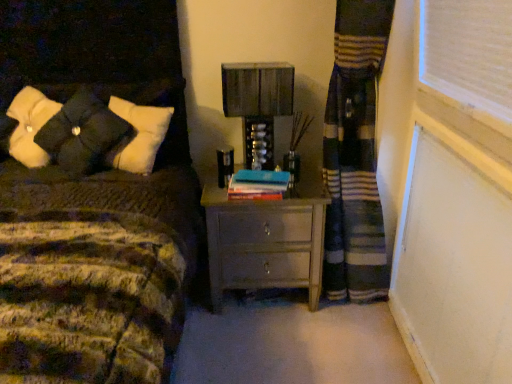
Question: Should I look upward or downward to see matte gray nightstand at center?

Choices:
 (A) down
 (B) up

Answer: (A)

Question: Are matte gray nightstand at center and metallic silver table lamp at center far apart?

Choices:
 (A) no
 (B) yes

Answer: (A)

Question: Is matte gray nightstand at center not inside metallic silver table lamp at center?

Choices:
 (A) yes
 (B) no

Answer: (A)

Question: Can you confirm if matte gray nightstand at center is wider than metallic silver table lamp at center?

Choices:
 (A) yes
 (B) no

Answer: (A)

Question: Is matte gray nightstand at center directly adjacent to metallic silver table lamp at center?

Choices:
 (A) no
 (B) yes

Answer: (A)

Question: Does matte gray nightstand at center have a lesser height compared to metallic silver table lamp at center?

Choices:
 (A) yes
 (B) no

Answer: (B)

Question: Is metallic silver table lamp at center completely or partially inside matte gray nightstand at center?

Choices:
 (A) yes
 (B) no

Answer: (B)

Question: Considering the relative sizes of metallic silver table lamp at center and matte gray nightstand at center in the image provided, is metallic silver table lamp at center taller than matte gray nightstand at center?

Choices:
 (A) yes
 (B) no

Answer: (B)

Question: Could you tell me if metallic silver table lamp at center is facing matte gray nightstand at center?

Choices:
 (A) no
 (B) yes

Answer: (A)

Question: Can you confirm if metallic silver table lamp at center is bigger than matte gray nightstand at center?

Choices:
 (A) no
 (B) yes

Answer: (A)

Question: Is metallic silver table lamp at center further to camera compared to matte gray nightstand at center?

Choices:
 (A) no
 (B) yes

Answer: (B)

Question: From the image's perspective, does metallic silver table lamp at center appear higher than matte gray nightstand at center?

Choices:
 (A) no
 (B) yes

Answer: (B)

Question: Does metallic silver table lamp at center have a smaller size compared to matte gray nightstand at center?

Choices:
 (A) yes
 (B) no

Answer: (A)

Question: Can you confirm if blue matte book at center is taller than matte gray nightstand at center?

Choices:
 (A) no
 (B) yes

Answer: (A)